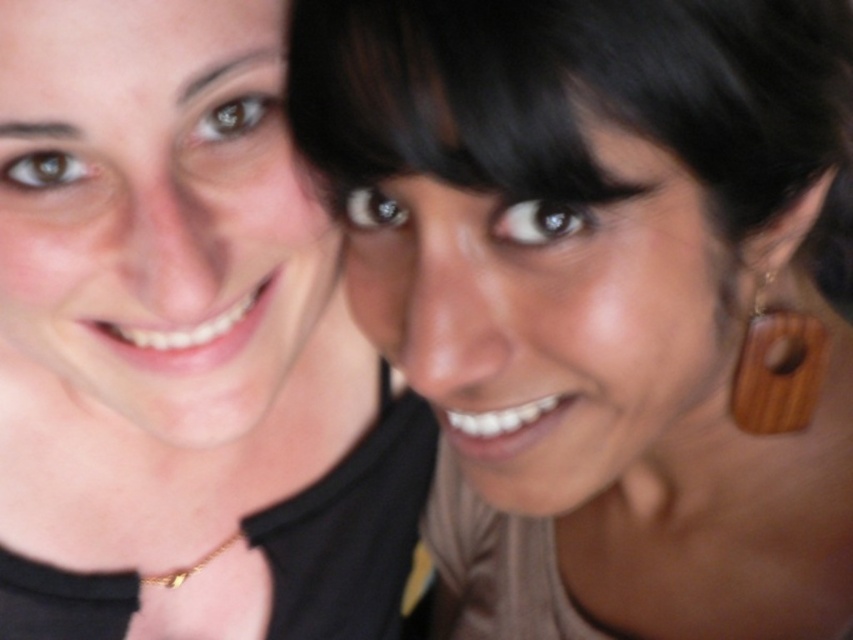
Question: Which point is farther to the camera?

Choices:
 (A) (175, 582)
 (B) (749, 408)

Answer: (A)

Question: Does matte black necklace at center have a smaller size compared to gold chain at lower center?

Choices:
 (A) yes
 (B) no

Answer: (B)

Question: Is brown wooden earrings at upper right to the right of matte black necklace at center from the viewer's perspective?

Choices:
 (A) no
 (B) yes

Answer: (B)

Question: Which object is the closest to the wooden pendant at right?

Choices:
 (A) gold chain at lower center
 (B) brown wooden earrings at upper right
 (C) matte black necklace at center

Answer: (B)

Question: Among these objects, which one is nearest to the camera?

Choices:
 (A) brown wooden earrings at upper right
 (B) wooden pendant at right
 (C) gold chain at lower center

Answer: (A)

Question: Does matte black necklace at center appear on the left side of wooden pendant at right?

Choices:
 (A) no
 (B) yes

Answer: (B)